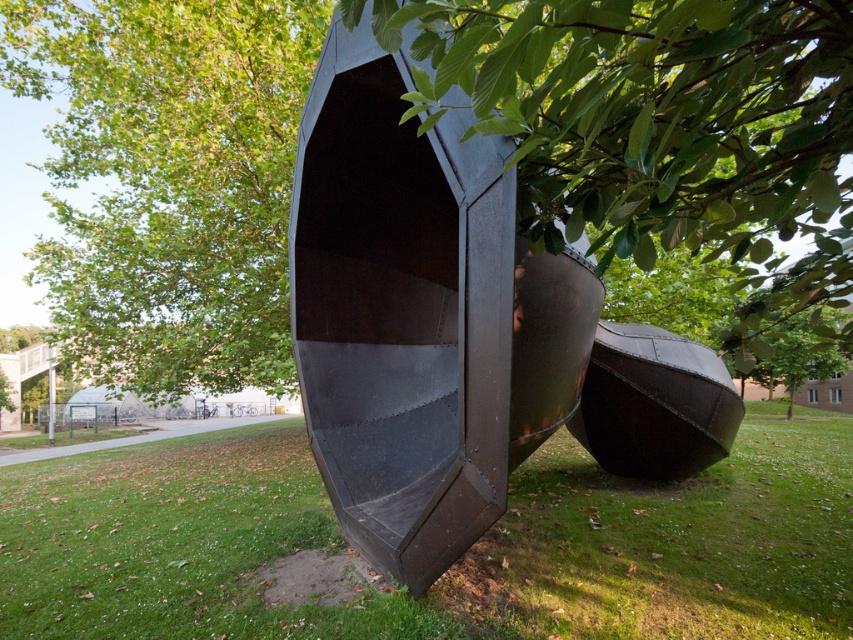
You are standing in front of the sculpture and want to take a photo of the green leafy tree at center without the green grass at lower center blocking the view. How should you adjust your position?

Move your position so that the green leafy tree at center is not obscured by the green grass at lower center. Since the green leafy tree at center is behind green grass at lower center, you can move forward to get closer to the tree, ensuring the grass is out of frame or adjust your angle to position the tree in a way that it doesn

You are standing in front of the sculpture and notice two green leafy trees in the background. Which tree, the green leafy tree at center or the green leafy tree at upper left, is taller?

The green leafy tree at upper left is taller than the green leafy tree at center.

You are a gardener planning to water the green grass at lower center and the green leafy tree at center. You have a hose that can reach 4 meters. Can you water both without moving the hose? Please explain your reasoning.

The green grass at lower center and the green leafy tree at center are 4.33 meters apart. Since the hose can only reach 4 meters, the distance between them exceeds the hose length. Therefore, you cannot water both without moving the hose.